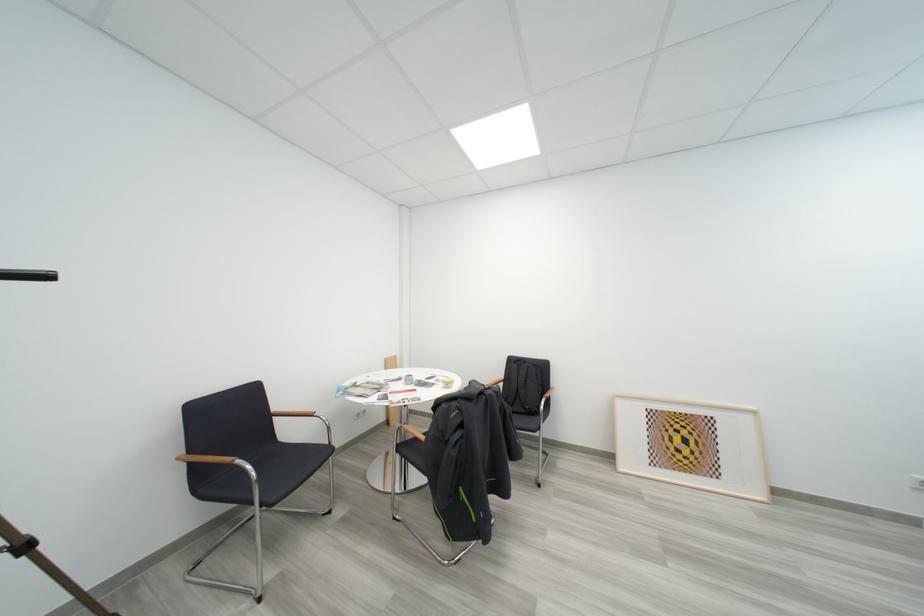
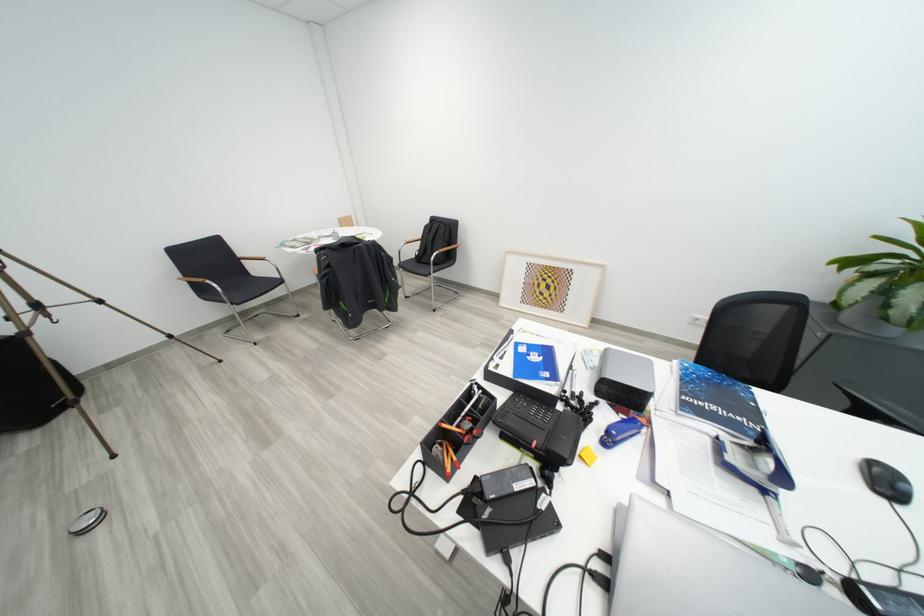
Find the pixel in the second image that matches point (551, 410) in the first image.

(442, 262)